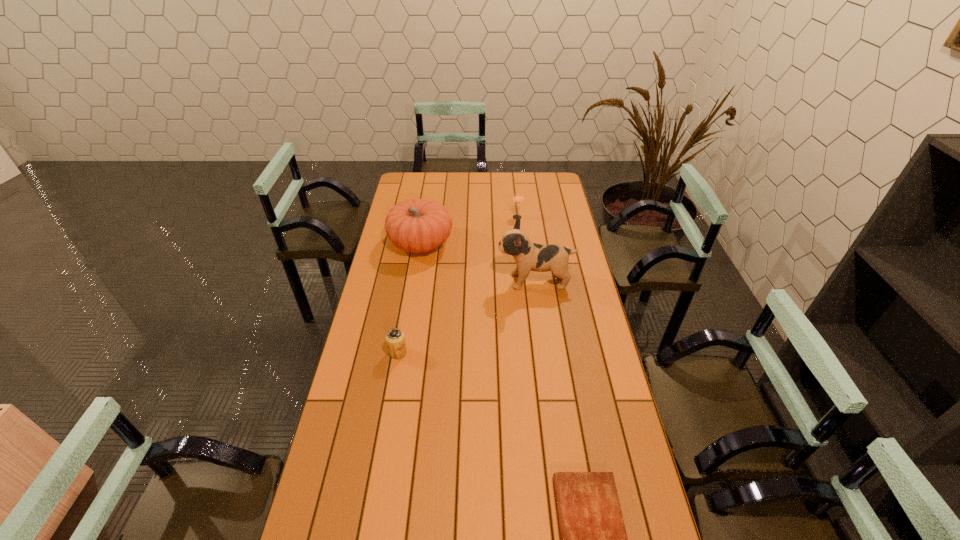
Where is `free location located on the right of the straw`? The height and width of the screenshot is (540, 960). free location located on the right of the straw is located at coordinates (564, 217).

You are a GUI agent. You are given a task and a screenshot of the screen. Output one action in this format:
    pyautogui.click(x=<x>, y=<y>)
    Task: Click on the vacant space positioned 0.190m on the back of the beer can
    
    Given the screenshot: What is the action you would take?
    pyautogui.click(x=406, y=307)

Find the location of `pumpkin that is positioned at the left edge`. pumpkin that is positioned at the left edge is located at coordinates (417, 226).

This screenshot has height=540, width=960. I want to click on beer can that is at the left edge, so click(x=395, y=339).

At what (x,y) coordinates should I click in order to perform the action: click on object at the right edge. Please return your answer as a coordinate pair (x, y). Looking at the image, I should click on (528, 256).

I want to click on vacant space at the far edge of the desktop, so click(456, 175).

You are a GUI agent. You are given a task and a screenshot of the screen. Output one action in this format:
    pyautogui.click(x=<x>, y=<y>)
    Task: Click on the free region at the left edge
    Image resolution: width=960 pixels, height=540 pixels.
    Given the screenshot: What is the action you would take?
    pyautogui.click(x=366, y=500)

The width and height of the screenshot is (960, 540). What are the coordinates of `free space at the right edge of the desktop` in the screenshot? It's located at (568, 233).

This screenshot has height=540, width=960. In order to click on vacant space that's between the straw and the fourth tallest object in this screenshot , I will do `click(457, 285)`.

What are the coordinates of `vacant area between the beer can and the pumpkin` in the screenshot? It's located at (410, 298).